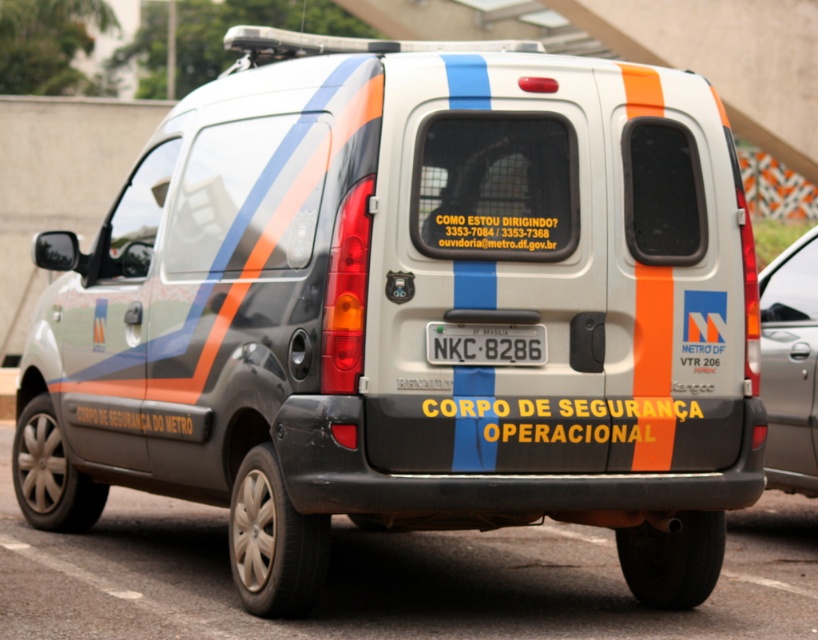
What is the spatial relationship between the metallic gray van at right and the white plastic license plate at center?

The metallic gray van at right is positioned on the right side of the white plastic license plate at center.

You are a pedestrian standing on the sidewalk. You see the metallic gray van at right and the white plastic license plate at center. Which object is taller?

The metallic gray van at right is much taller than the white plastic license plate at center.

You are standing on the sidewalk and looking at the metallic gray van at right. What are the coordinates where you can find it?

The metallic gray van at right is located at coordinates point (790, 365).